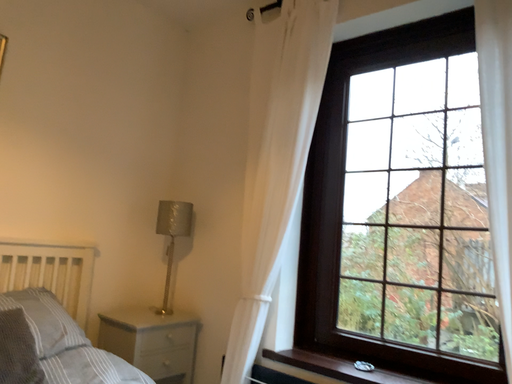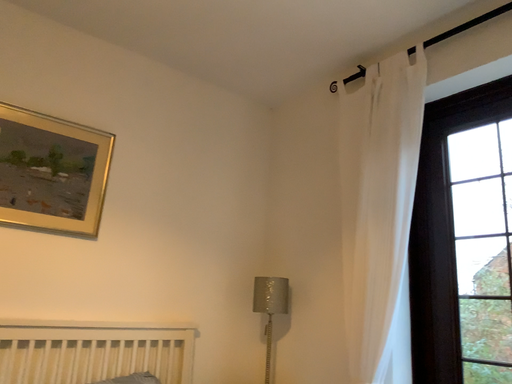
Question: How did the camera likely rotate when shooting the video?

Choices:
 (A) rotated right
 (B) rotated left

Answer: (B)